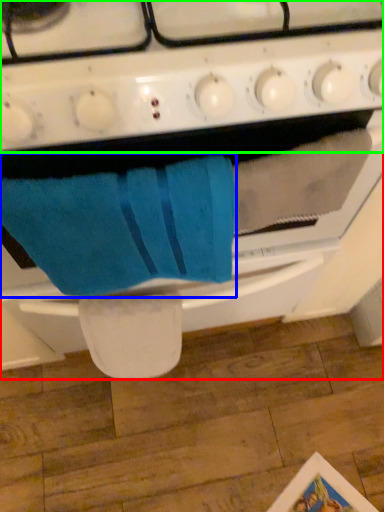
Question: Considering the real-world distances, which object is closest to oven (highlighted by a red box)? bath towel (highlighted by a blue box) or gas stove (highlighted by a green box).

Choices:
 (A) bath towel
 (B) gas stove

Answer: (A)